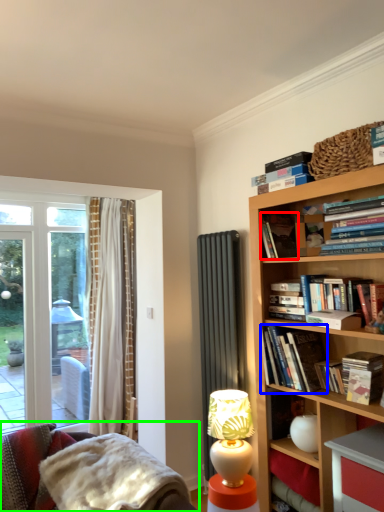
Question: Based on their relative distances, which object is farther from book (highlighted by a red box)? Choose from book (highlighted by a blue box) and studio couch (highlighted by a green box).

Choices:
 (A) book
 (B) studio couch

Answer: (B)